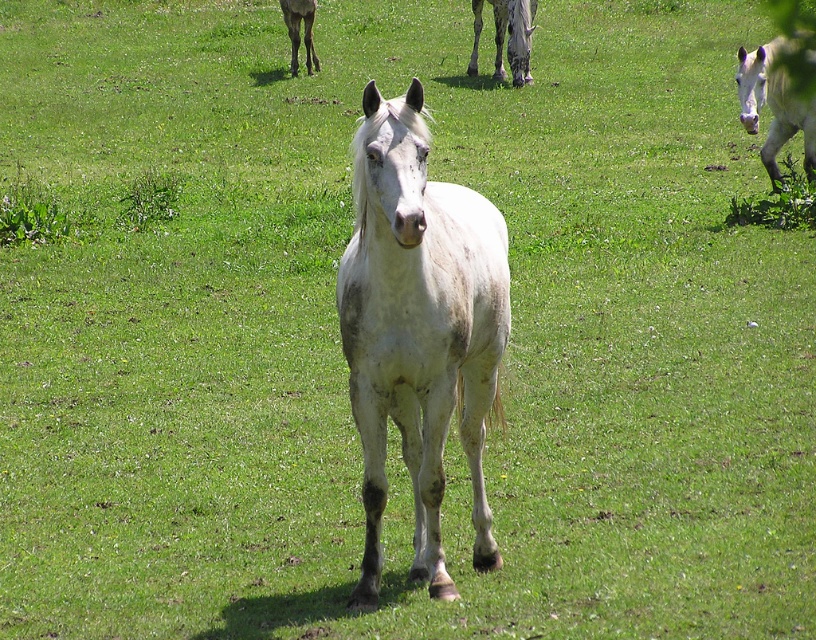
Question: Is speckled gray horse at upper center to the left of white speckled coat at center from the viewer's perspective?

Choices:
 (A) no
 (B) yes

Answer: (A)

Question: Among these objects, which one is nearest to the camera?

Choices:
 (A) white speckled coat at center
 (B) speckled gray horse at upper center

Answer: (B)

Question: Can you confirm if white speckled horse at center is positioned below white matte horse at upper right?

Choices:
 (A) yes
 (B) no

Answer: (A)

Question: Does white speckled horse at center appear on the right side of speckled gray horse at upper center?

Choices:
 (A) yes
 (B) no

Answer: (B)

Question: Which object appears farthest from the camera in this image?

Choices:
 (A) white speckled coat at center
 (B) speckled gray horse at upper center
 (C) white matte horse at upper right

Answer: (A)

Question: Which point is closer to the camera?

Choices:
 (A) white speckled coat at center
 (B) white matte horse at upper right
 (C) white speckled horse at center
 (D) speckled gray horse at upper center

Answer: (C)